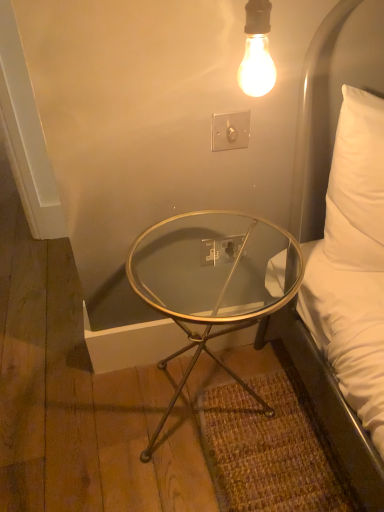
How much space does white plastic outlet at center, which is counted as the first electric outlet, starting from the bottom, occupy horizontally?

It is 0.47 inches.

Locate an element on the screen. white plastic outlet at center, which is counted as the second electric outlet, starting from the top is located at coordinates (221, 250).

Identify the location of clear glass table at lower center. (208, 278).

Is white plastic switch at upper center, the first electric outlet from the top, bigger than clear glass table at lower center?

Incorrect, white plastic switch at upper center, the first electric outlet from the top, is not larger than clear glass table at lower center.

From the picture: Does white plastic switch at upper center, which is the second electric outlet from back to front, have a lesser width compared to clear glass table at lower center?

Indeed, white plastic switch at upper center, which is the second electric outlet from back to front, has a lesser width compared to clear glass table at lower center.

How different are the orientations of white plastic switch at upper center, acting as the second electric outlet starting from the bottom, and clear glass table at lower center in degrees?

The angular difference between white plastic switch at upper center, acting as the second electric outlet starting from the bottom, and clear glass table at lower center is 0.162 degrees.

Considering the relative sizes of white plastic switch at upper center, acting as the second electric outlet starting from the bottom, and clear glass table at lower center in the image provided, is white plastic switch at upper center, acting as the second electric outlet starting from the bottom, shorter than clear glass table at lower center?

Yes.

Are clear glass table at lower center and white plastic outlet at center, positioned as the 2th electric outlet in front-to-back order, making contact?

No, clear glass table at lower center is not making contact with white plastic outlet at center, positioned as the 2th electric outlet in front-to-back order.

Which of these two, clear glass table at lower center or white plastic outlet at center, positioned as the 2th electric outlet in front-to-back order, is bigger?

Bigger between the two is clear glass table at lower center.

Between clear glass table at lower center and white plastic outlet at center, which is counted as the first electric outlet, starting from the bottom, which one has smaller width?

Thinner between the two is white plastic outlet at center, which is counted as the first electric outlet, starting from the bottom.

From the image's perspective, between white plastic switch at upper center, acting as the second electric outlet starting from the bottom, and white plastic outlet at center, positioned as the 2th electric outlet in front-to-back order, which one is located above?

From the image's view, white plastic switch at upper center, acting as the second electric outlet starting from the bottom, is above.

The height and width of the screenshot is (512, 384). What are the coordinates of `electric outlet on the left of white plastic outlet at center, which is counted as the first electric outlet, starting from the bottom` in the screenshot? It's located at (230, 131).

Which of these two, white plastic switch at upper center, the first electric outlet from the top, or white plastic outlet at center, marked as the 1th electric outlet in a back-to-front arrangement, is wider?

white plastic switch at upper center, the first electric outlet from the top.

In the scene shown: Which of these two, clear glass table at lower center or white plastic switch at upper center, which is the second electric outlet from back to front, is bigger?

Bigger between the two is clear glass table at lower center.

Is clear glass table at lower center facing towards white plastic switch at upper center, the first electric outlet from the top?

No, clear glass table at lower center is not turned towards white plastic switch at upper center, the first electric outlet from the top.

Does clear glass table at lower center have a greater height compared to white plastic switch at upper center, acting as the second electric outlet starting from the bottom?

Yes, clear glass table at lower center is taller than white plastic switch at upper center, acting as the second electric outlet starting from the bottom.

Is clear glass table at lower center not near white plastic switch at upper center, acting as the second electric outlet starting from the bottom?

No, clear glass table at lower center is not far from white plastic switch at upper center, acting as the second electric outlet starting from the bottom.

Image resolution: width=384 pixels, height=512 pixels. What are the coordinates of `electric outlet to the right of white plastic switch at upper center, which is the second electric outlet from back to front` in the screenshot? It's located at (221, 250).

Is white plastic outlet at center, marked as the 1th electric outlet in a back-to-front arrangement, bigger than white plastic switch at upper center, acting as the second electric outlet starting from the bottom?

No, white plastic outlet at center, marked as the 1th electric outlet in a back-to-front arrangement, is not bigger than white plastic switch at upper center, acting as the second electric outlet starting from the bottom.

Who is more distant, white plastic outlet at center, positioned as the 2th electric outlet in front-to-back order, or white plastic switch at upper center, acting as the second electric outlet starting from the bottom?

white plastic outlet at center, positioned as the 2th electric outlet in front-to-back order, is behind.

Is white plastic outlet at center, which is counted as the second electric outlet, starting from the top, shorter than white plastic switch at upper center, which is the 1th electric outlet in front-to-back order?

Correct, white plastic outlet at center, which is counted as the second electric outlet, starting from the top, is not as tall as white plastic switch at upper center, which is the 1th electric outlet in front-to-back order.

Looking at their sizes, would you say white plastic outlet at center, marked as the 1th electric outlet in a back-to-front arrangement, is wider or thinner than clear glass table at lower center?

Considering their sizes, white plastic outlet at center, marked as the 1th electric outlet in a back-to-front arrangement, looks slimmer than clear glass table at lower center.

Looking at this image, from a real-world perspective, which object stands above the other?

white plastic outlet at center, marked as the 1th electric outlet in a back-to-front arrangement.

Is white plastic outlet at center, which is counted as the first electric outlet, starting from the bottom, oriented towards clear glass table at lower center?

Yes, white plastic outlet at center, which is counted as the first electric outlet, starting from the bottom, is oriented towards clear glass table at lower center.

Is white plastic outlet at center, which is counted as the second electric outlet, starting from the top, shorter than clear glass table at lower center?

Correct, white plastic outlet at center, which is counted as the second electric outlet, starting from the top, is not as tall as clear glass table at lower center.

Where is `the 1st electric outlet behind the clear glass table at lower center`? This screenshot has width=384, height=512. the 1st electric outlet behind the clear glass table at lower center is located at coordinates (230, 131).

This screenshot has height=512, width=384. In order to click on coffee table that is under the white plastic outlet at center, which is counted as the first electric outlet, starting from the bottom (from a real-world perspective) in this screenshot , I will do `click(208, 278)`.

Based on their spatial positions, is white plastic switch at upper center, which is the 1th electric outlet in front-to-back order, or white plastic outlet at center, positioned as the 2th electric outlet in front-to-back order, further from clear glass table at lower center?

white plastic switch at upper center, which is the 1th electric outlet in front-to-back order, is further to clear glass table at lower center.

Based on their spatial positions, is clear glass table at lower center or white plastic switch at upper center, which is the 1th electric outlet in front-to-back order, further from white plastic outlet at center, marked as the 1th electric outlet in a back-to-front arrangement?

white plastic switch at upper center, which is the 1th electric outlet in front-to-back order, is further to white plastic outlet at center, marked as the 1th electric outlet in a back-to-front arrangement.

Based on their spatial positions, is white plastic outlet at center, positioned as the 2th electric outlet in front-to-back order, or white plastic switch at upper center, the first electric outlet from the top, further from clear glass table at lower center?

white plastic switch at upper center, the first electric outlet from the top, is further to clear glass table at lower center.

Looking at the image, which one is located further to white plastic outlet at center, positioned as the 2th electric outlet in front-to-back order, white plastic switch at upper center, acting as the second electric outlet starting from the bottom, or clear glass table at lower center?

white plastic switch at upper center, acting as the second electric outlet starting from the bottom, is positioned further to the anchor white plastic outlet at center, positioned as the 2th electric outlet in front-to-back order.

Based on the photo, considering their positions, is white plastic outlet at center, positioned as the 2th electric outlet in front-to-back order, positioned further to white plastic switch at upper center, acting as the second electric outlet starting from the bottom, than clear glass table at lower center?

clear glass table at lower center is positioned further to the anchor white plastic switch at upper center, acting as the second electric outlet starting from the bottom.

Estimate the real-world distances between objects in this image. Which object is further from white plastic switch at upper center, the first electric outlet from the top, clear glass table at lower center or white plastic outlet at center, which is counted as the first electric outlet, starting from the bottom?

Result: clear glass table at lower center lies further to white plastic switch at upper center, the first electric outlet from the top, than the other object.

The height and width of the screenshot is (512, 384). I want to click on electric outlet that lies between white plastic switch at upper center, which is the 1th electric outlet in front-to-back order, and clear glass table at lower center from top to bottom, so click(x=221, y=250).